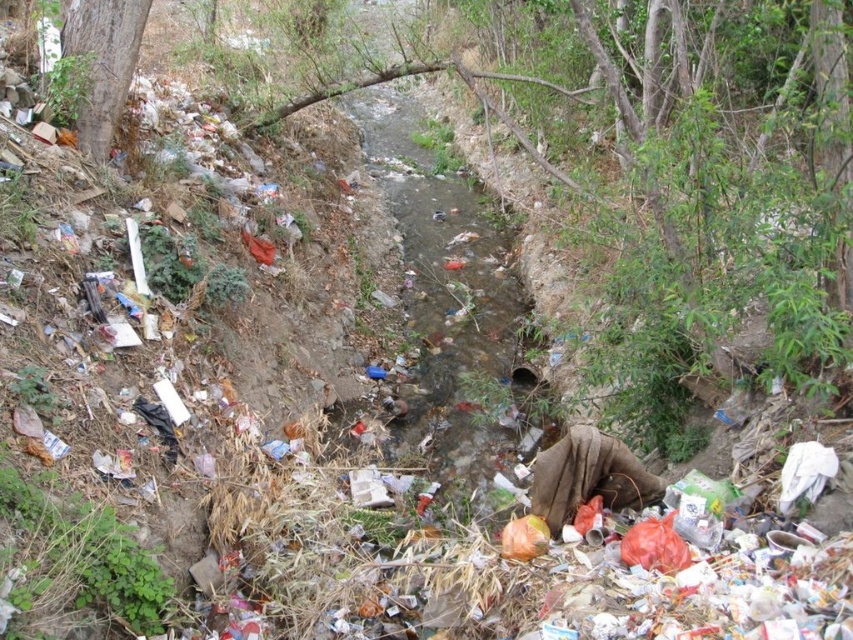
Does brown rough tree at center come in front of smooth brown tree trunk at upper left?

Yes, brown rough tree at center is in front of smooth brown tree trunk at upper left.

Is brown rough tree at center behind smooth brown tree trunk at upper left?

That is False.

Describe the element at coordinates (624, 170) in the screenshot. I see `brown rough tree at center` at that location.

Identify the location of brown rough tree at center. (624, 170).